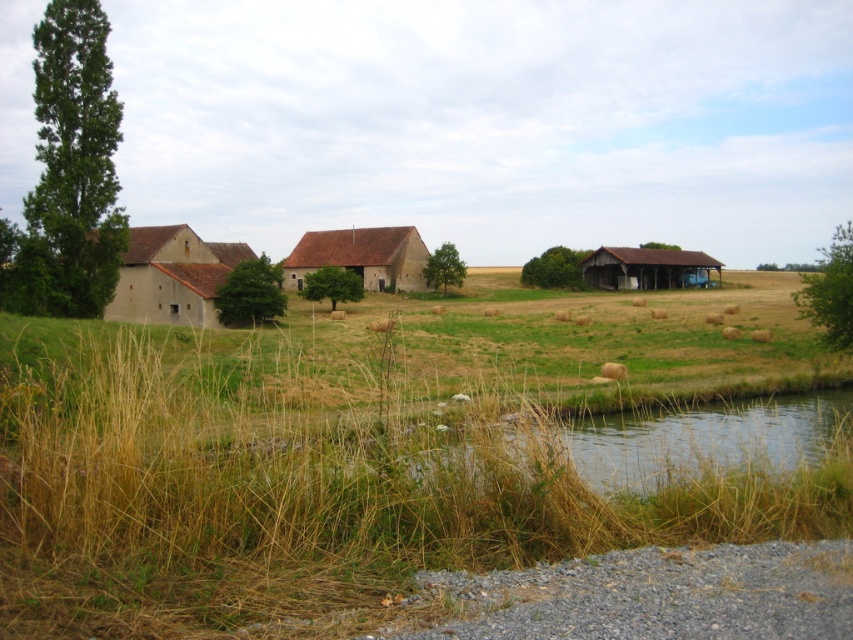
Between beige stucco barn at left and brown wooden barn at right, which one appears on the right side from the viewer's perspective?

From the viewer's perspective, brown wooden barn at right appears more on the right side.

Identify the location of beige stucco barn at left. This screenshot has width=853, height=640. (172, 276).

Find the location of a particular element. beige stucco barn at left is located at coordinates (172, 276).

Which is behind, point (143, 388) or point (402, 269)?

The point (402, 269) is behind.

The image size is (853, 640). What do you see at coordinates (393, 452) in the screenshot? I see `dry grass at lower left` at bounding box center [393, 452].

The image size is (853, 640). In order to click on dry grass at lower left in this screenshot , I will do `click(393, 452)`.

Find the location of a particular element. The width and height of the screenshot is (853, 640). dry grass at lower left is located at coordinates pos(393,452).

Identify the location of beige stucco barn at left. Image resolution: width=853 pixels, height=640 pixels. (172, 276).

Describe the element at coordinates (172, 276) in the screenshot. I see `beige stucco barn at left` at that location.

Is point (154, 285) farther from camera compared to point (361, 236)?

No.

You are a GUI agent. You are given a task and a screenshot of the screen. Output one action in this format:
    pyautogui.click(x=<x>, y=<y>)
    Task: Click on the beige stucco barn at left
    
    Given the screenshot: What is the action you would take?
    pyautogui.click(x=172, y=276)